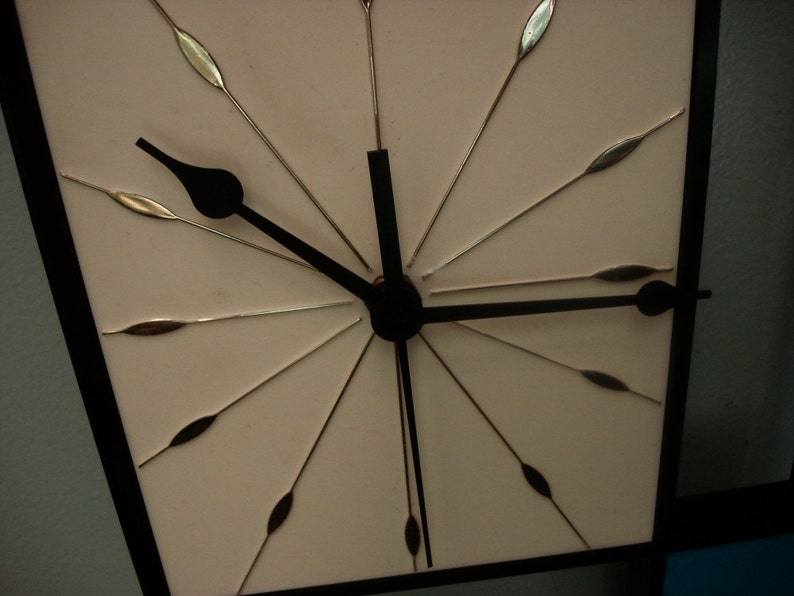
The width and height of the screenshot is (794, 596). I want to click on black border around the clock, so click(x=120, y=474), click(x=681, y=365), click(x=522, y=568).